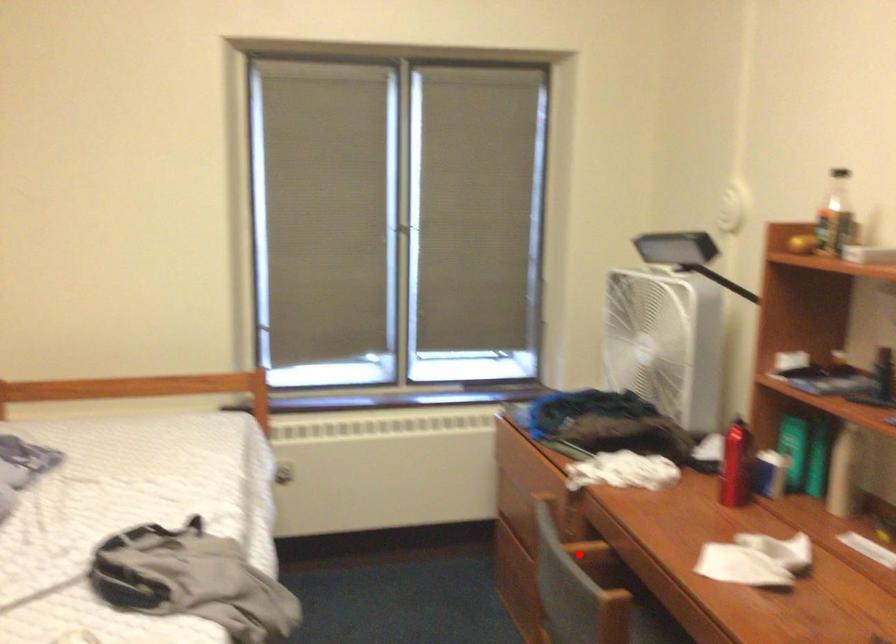
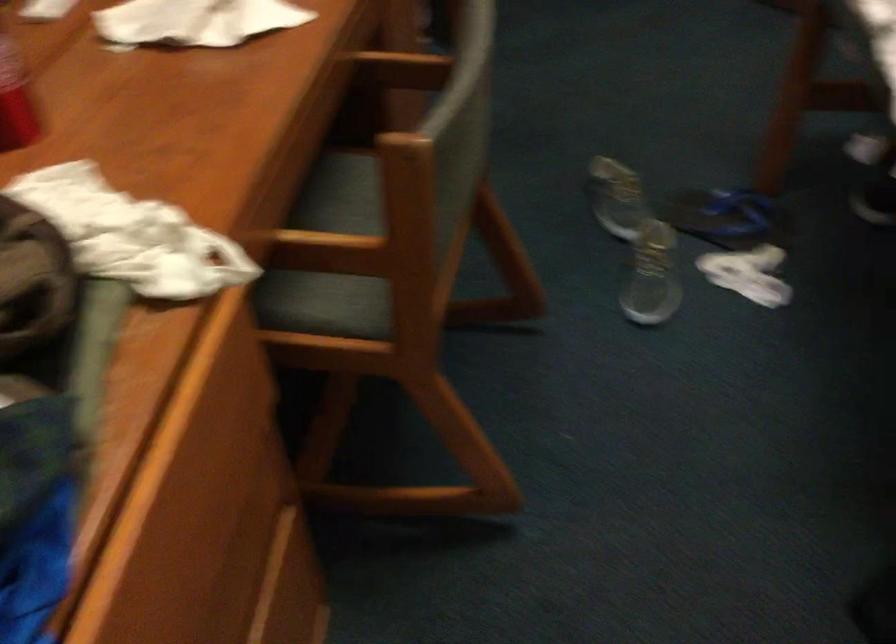
Question: I am providing you with two images of the same scene from different viewpoints. Image1 has a red point marked. In image2, the corresponding 3D location appears at what relative position? Reply with the corresponding letter.

Choices:
 (A) Closer
 (B) Farther

Answer: (A)